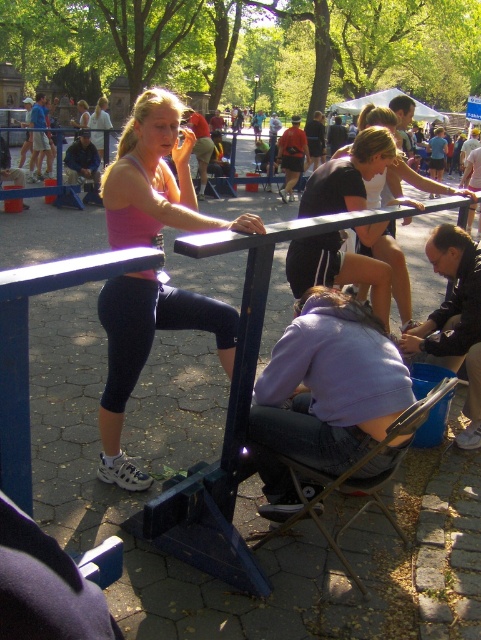
In the scene shown: You are standing at the camera position and want to take a photo of the woman stretching on the blue exercise machine and the point at coordinates (354, 364). Which object is closer to you?

The point at coordinates (354, 364) is closer to you since it is only 7.35 feet away, whereas the woman stretching on the blue exercise machine is farther away.

You are a photographer positioned at the edge of the park, aiming to capture a photo that includes both the pink fabric tank top at center and the metallic silver chair at lower center. Based on their positions, which object will appear closer to the camera in the final photo?

The pink fabric tank top at center will appear closer to the camera in the photo because it is further to the viewer than the metallic silver chair at lower center, meaning it is positioned nearer to the photographer.